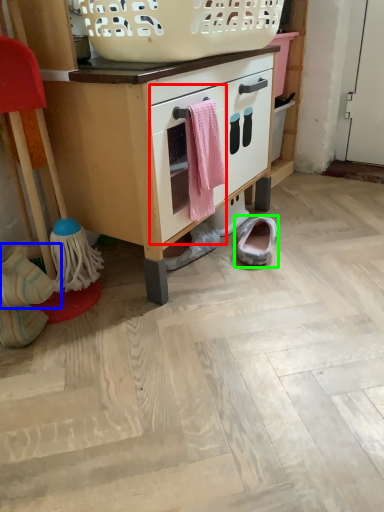
Question: Which object is positioned farthest from drawer (highlighted by a red box)? Select from footwear (highlighted by a blue box) and footwear (highlighted by a green box).

Choices:
 (A) footwear
 (B) footwear

Answer: (A)